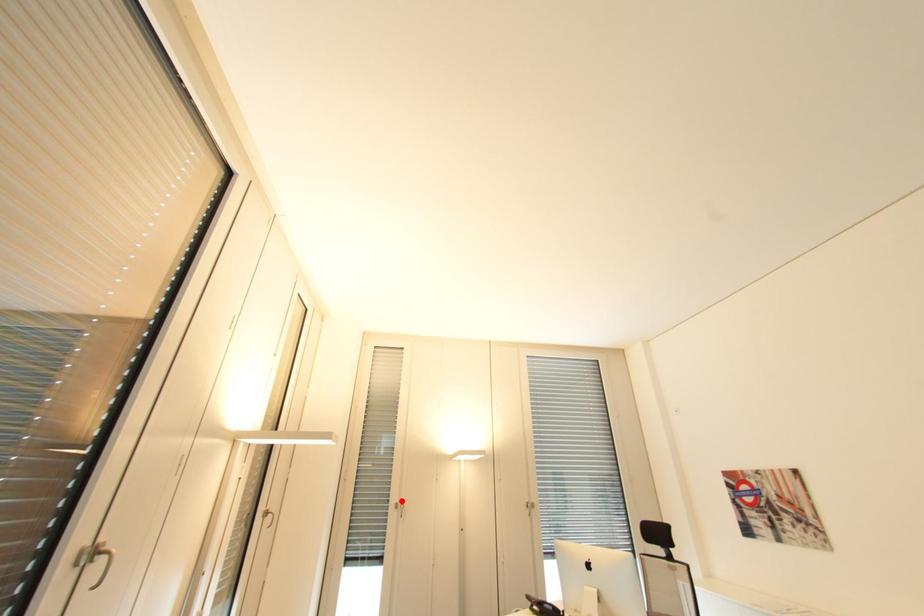
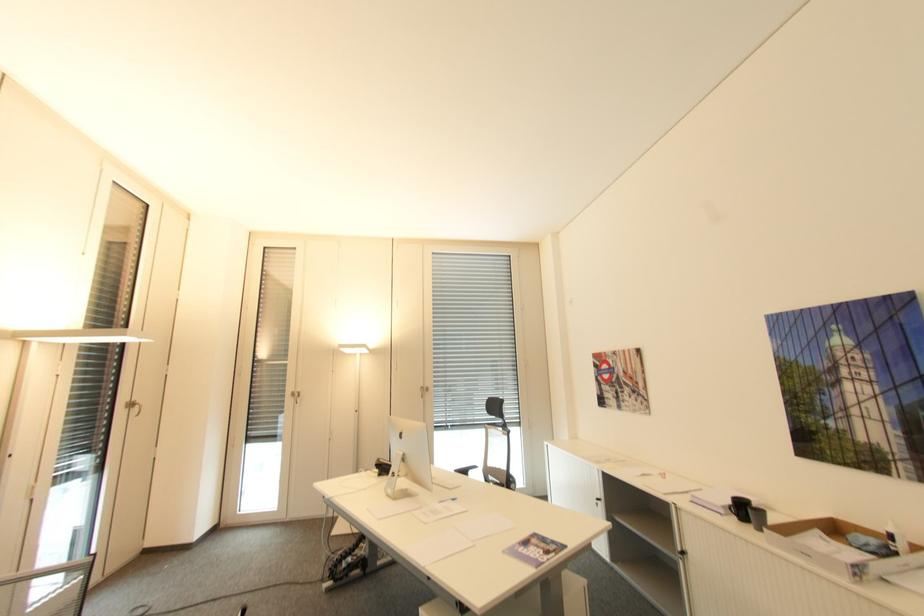
In the second image, find the point that corresponds to the highlighted location in the first image.

(298, 390)